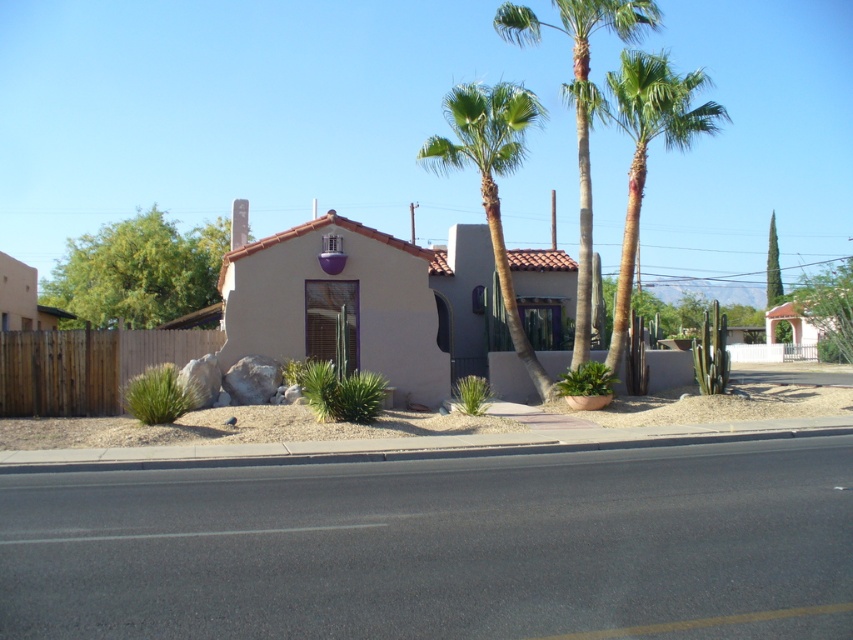
You are standing in front of the house and want to determine the relative positions of two points marked on the ground. Which point is closer to you, point at coordinate [578,317] or point at coordinate [848,273]?

Point at coordinate [578,317] is closer to you than point at coordinate [848,273] because it is positioned closer to the viewer according to the description.

You are a visitor approaching the house and want to see both the brown wooden fence at left and the green leafy tree at upper right. Which object will appear larger in your view as you get closer to the house?

The brown wooden fence at left will appear larger because it is closer to the viewer than the green leafy tree at upper right.

You are standing in front of the house and see a point marked at coordinates (491, 177). What object is located at that point?

The point at (491, 177) indicates a green leafy palm tree at center.